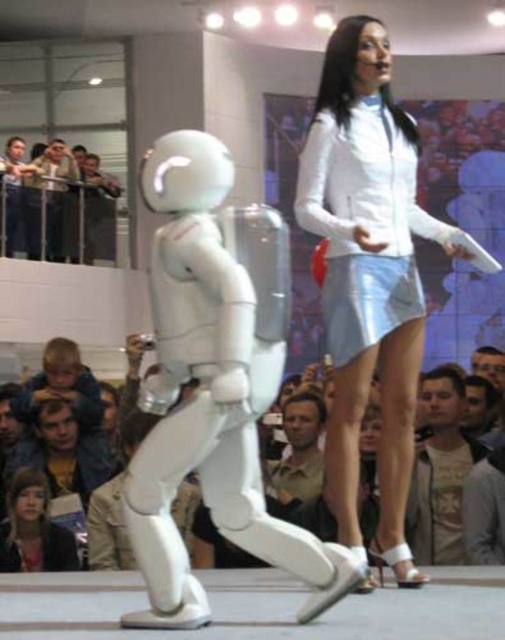
Question: Is light brown leather jacket at lower right further to the viewer compared to brown leather jacket at lower center?

Choices:
 (A) yes
 (B) no

Answer: (B)

Question: Which point is closer to the camera?

Choices:
 (A) (420, 429)
 (B) (344, 253)
 (C) (273, 508)
 (D) (374, 436)

Answer: (B)

Question: Where is light brown leather jacket at lower right located in relation to brown leather jacket at lower center in the image?

Choices:
 (A) above
 (B) below

Answer: (B)

Question: Can you confirm if smooth skin crowd at center is positioned above light brown leather jacket at lower right?

Choices:
 (A) no
 (B) yes

Answer: (B)

Question: Based on their relative distances, which object is nearer to the smooth skin crowd at center?

Choices:
 (A) brown leather jacket at lower center
 (B) light brown leather jacket at lower right

Answer: (A)

Question: Which point appears farthest from the camera in this image?

Choices:
 (A) (308, 406)
 (B) (378, 250)

Answer: (A)